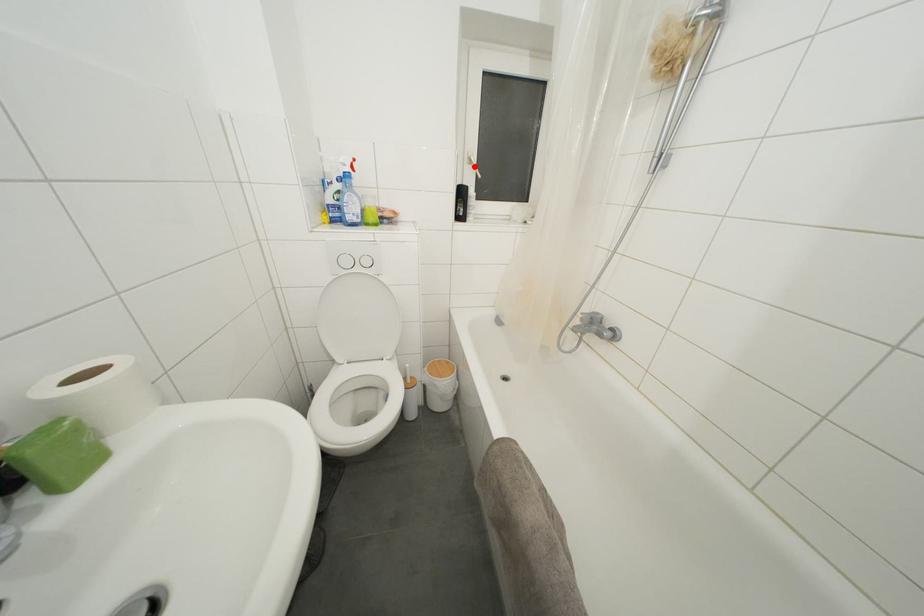
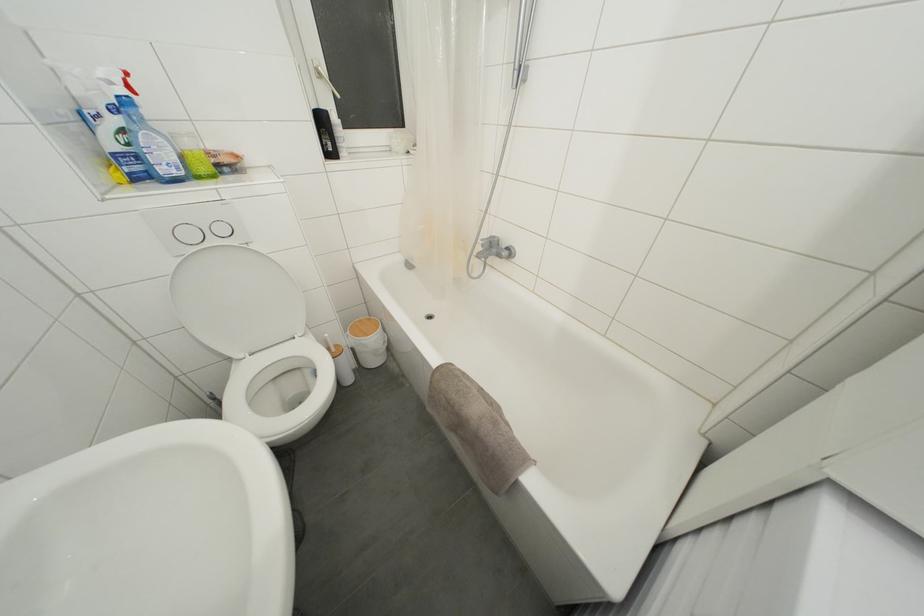
In the second image, find the point that corresponds to the highlighted location in the first image.

(323, 79)